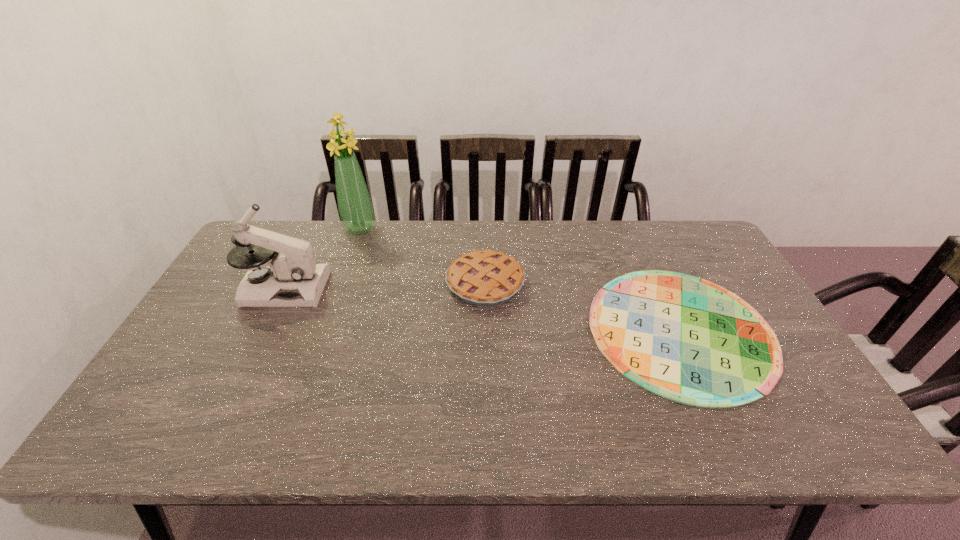
Identify the location of free spot between the pie and the shortest object. (583, 307).

The image size is (960, 540). I want to click on free point between the pie and the bouquet, so click(422, 256).

Where is `vacant area between the microscope and the farthest object`? This screenshot has width=960, height=540. vacant area between the microscope and the farthest object is located at coordinates (323, 259).

Locate an element on the screen. The width and height of the screenshot is (960, 540). unoccupied area between the shortest object and the second shortest object is located at coordinates (583, 307).

Image resolution: width=960 pixels, height=540 pixels. Identify the location of free spot between the third shortest object and the tallest object. (323, 259).

Image resolution: width=960 pixels, height=540 pixels. Find the location of `vacant area that lies between the bouquet and the second tallest object`. vacant area that lies between the bouquet and the second tallest object is located at coordinates (323, 259).

Where is `vacant space that is in between the gameboard and the second shortest object`? This screenshot has height=540, width=960. vacant space that is in between the gameboard and the second shortest object is located at coordinates (583, 307).

Where is `vacant area that lies between the second shortest object and the microscope`? vacant area that lies between the second shortest object and the microscope is located at coordinates (385, 286).

The width and height of the screenshot is (960, 540). Identify the location of free space between the third object from left to right and the rightmost object. 583,307.

Find the location of a particular element. Image resolution: width=960 pixels, height=540 pixels. object that stands as the closest to the second shortest object is located at coordinates (686, 339).